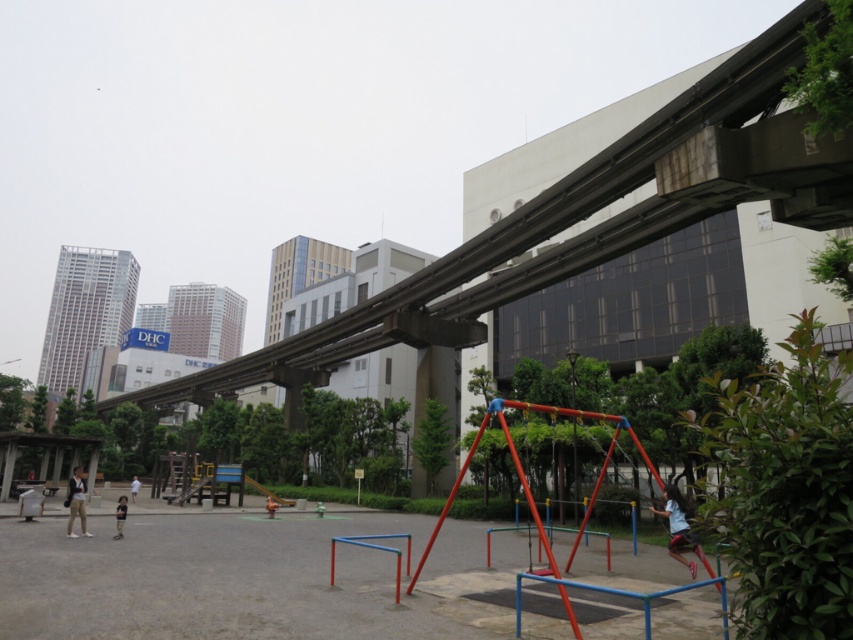
Looking at this image, between light brown wooden toy at lower left and white cotton shirt at center, which one appears on the right side from the viewer's perspective?

→ light brown wooden toy at lower left

Can you confirm if light brown wooden toy at lower left is taller than white cotton shirt at center?

In fact, light brown wooden toy at lower left may be shorter than white cotton shirt at center.

Where is `light brown wooden toy at lower left`? Image resolution: width=853 pixels, height=640 pixels. light brown wooden toy at lower left is located at coordinates (120, 515).

From the picture: Between light blue fabric swing at center and light brown wooden toy at lower left, which one is positioned lower?

light brown wooden toy at lower left is below.

Who is more forward, [677,506] or [123,515]?

Positioned in front is point [677,506].

This screenshot has width=853, height=640. I want to click on light blue fabric swing at center, so click(x=677, y=528).

Is point (68, 518) farther from viewer compared to point (138, 490)?

No, (68, 518) is in front of (138, 490).

Is matte gray jacket at lower left to the left of white cotton shirt at center from the viewer's perspective?

No, matte gray jacket at lower left is not to the left of white cotton shirt at center.

Where is `matte gray jacket at lower left`? This screenshot has width=853, height=640. matte gray jacket at lower left is located at coordinates (76, 502).

The height and width of the screenshot is (640, 853). I want to click on matte gray jacket at lower left, so click(x=76, y=502).